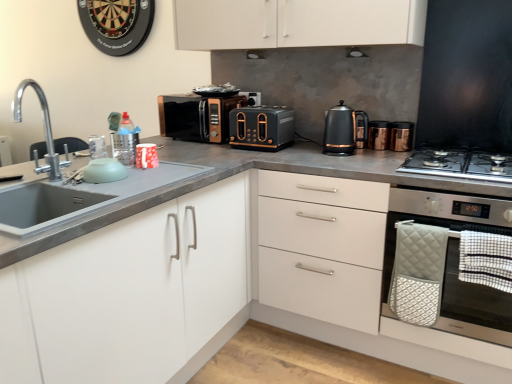
Describe the element at coordinates (342, 130) in the screenshot. I see `black metallic kettle at upper right` at that location.

How much space does black matte toaster at center, which is counted as the 4th appliance, starting from the bottom, occupy horizontally?

0.56 inches.

What is the approximate height of white matte cabinet at center, arranged as the 2th cabinetry when viewed from the left?

white matte cabinet at center, arranged as the 2th cabinetry when viewed from the left, is 22.21 inches in height.

Identify the location of matte black toaster at center. The width and height of the screenshot is (512, 384). (261, 128).

Identify the location of matte green bowl at left, which appears as the fourth appliance when viewed from the back. The image size is (512, 384). (104, 171).

How much space does matte green bowl at left, arranged as the first appliance when ordered from the bottom, occupy vertically?

matte green bowl at left, arranged as the first appliance when ordered from the bottom, is 7.90 centimeters tall.

Describe the element at coordinates (130, 293) in the screenshot. The width and height of the screenshot is (512, 384). I see `white matte cabinet at left, the first cabinetry viewed from the left` at that location.

Image resolution: width=512 pixels, height=384 pixels. What do you see at coordinates (197, 117) in the screenshot?
I see `black glossy microwave at center` at bounding box center [197, 117].

The width and height of the screenshot is (512, 384). Describe the element at coordinates (45, 130) in the screenshot. I see `chrome metallic faucet at left` at that location.

Locate an element on the screen. black metallic kettle at upper right is located at coordinates (342, 130).

Where is `cabinetry that is on the right side of black glossy microwave at center`? The width and height of the screenshot is (512, 384). cabinetry that is on the right side of black glossy microwave at center is located at coordinates (258, 258).

Can you confirm if white matte cabinet at center, arranged as the 2th cabinetry when viewed from the left, is wider than black glossy microwave at center?

Indeed, white matte cabinet at center, arranged as the 2th cabinetry when viewed from the left, has a greater width compared to black glossy microwave at center.

Can you confirm if white matte cabinet at center, arranged as the 2th cabinetry when viewed from the left, is taller than black glossy microwave at center?

Yes, white matte cabinet at center, arranged as the 2th cabinetry when viewed from the left, is taller than black glossy microwave at center.

What's the angular difference between white matte cabinet at left, the first cabinetry viewed from the left, and white matte cabinet at center, arranged as the 2th cabinetry when viewed from the left,'s facing directions?

They differ by 89.9 degrees in their facing directions.

From a real-world perspective, which is physically above, white matte cabinet at left, the first cabinetry viewed from the left, or white matte cabinet at center, marked as the first cabinetry in a right-to-left arrangement?

From a 3D spatial view, white matte cabinet at center, marked as the first cabinetry in a right-to-left arrangement, is above.

Does point (59, 372) come in front of point (362, 165)?

Yes, it is in front of point (362, 165).

Considering the positions of objects black matte toaster at center, the first appliance viewed from the back, and stainless steel gas stove at right in the image provided, who is more to the left, black matte toaster at center, the first appliance viewed from the back, or stainless steel gas stove at right?

black matte toaster at center, the first appliance viewed from the back, is more to the left.

Is black matte toaster at center, arranged as the 4th appliance when viewed from the front, in front of stainless steel gas stove at right?

No, it is behind stainless steel gas stove at right.

Is stainless steel gas stove at right a part of black matte toaster at center, arranged as the 4th appliance when viewed from the front?

No, stainless steel gas stove at right is located outside of black matte toaster at center, arranged as the 4th appliance when viewed from the front.

Does point (253, 97) lie in front of point (493, 177)?

No.

Is point (213, 131) more distant than point (451, 150)?

Yes, point (213, 131) is farther from viewer.

Is black glossy microwave at center to the left of stainless steel gas stove at right from the viewer's perspective?

Yes, black glossy microwave at center is to the left of stainless steel gas stove at right.

Considering the relative sizes of black glossy microwave at center and stainless steel gas stove at right in the image provided, is black glossy microwave at center smaller than stainless steel gas stove at right?

Incorrect, black glossy microwave at center is not smaller in size than stainless steel gas stove at right.

From the image's perspective, between gold metallic canister at upper right, placed as the second appliance when sorted from front to back, and black matte toaster at center, the first appliance viewed from the back, which one is located above?

black matte toaster at center, the first appliance viewed from the back, from the image's perspective.

What's the angular difference between gold metallic canister at upper right, which is counted as the third appliance, starting from the top, and black matte toaster at center, arranged as the 4th appliance when viewed from the front,'s facing directions?

The angle between the facing direction of gold metallic canister at upper right, which is counted as the third appliance, starting from the top, and the facing direction of black matte toaster at center, arranged as the 4th appliance when viewed from the front, is 2.74 degrees.

Looking at this image, is gold metallic canister at upper right, which is counted as the third appliance, starting from the top, looking in the opposite direction of black matte toaster at center, which is the second appliance in left-to-right order?

No, gold metallic canister at upper right, which is counted as the third appliance, starting from the top,'s orientation is not away from black matte toaster at center, which is the second appliance in left-to-right order.

From a real-world perspective, is gold metallic canister at upper right, which ranks as the 3th appliance in back-to-front order, on top of black matte toaster at center, which is counted as the 4th appliance, starting from the bottom?

Incorrect, from a real-world perspective, gold metallic canister at upper right, which ranks as the 3th appliance in back-to-front order, is lower than black matte toaster at center, which is counted as the 4th appliance, starting from the bottom.

Considering the sizes of black matte exhaust hood at upper center, acting as the second exhaust hood starting from the front, and metallic copper kettle at upper right, the 3th appliance from the bottom, in the image, is black matte exhaust hood at upper center, acting as the second exhaust hood starting from the front, taller or shorter than metallic copper kettle at upper right, the 3th appliance from the bottom,?

black matte exhaust hood at upper center, acting as the second exhaust hood starting from the front, is shorter than metallic copper kettle at upper right, the 3th appliance from the bottom.

From the image's perspective, is black matte exhaust hood at upper center, marked as the first exhaust hood in a left-to-right arrangement, on metallic copper kettle at upper right, the 3th appliance from the bottom?

Yes, from the image's perspective, black matte exhaust hood at upper center, marked as the first exhaust hood in a left-to-right arrangement, is over metallic copper kettle at upper right, the 3th appliance from the bottom.

Looking at their sizes, would you say black matte exhaust hood at upper center, which is the 1th exhaust hood in back-to-front order, is wider or thinner than metallic copper kettle at upper right, which is counted as the third appliance, starting from the front?

black matte exhaust hood at upper center, which is the 1th exhaust hood in back-to-front order, is wider than metallic copper kettle at upper right, which is counted as the third appliance, starting from the front.

How different are the orientations of black matte exhaust hood at upper center, which is the 1th exhaust hood in back-to-front order, and metallic copper kettle at upper right, the 2th appliance from the right, in degrees?

black matte exhaust hood at upper center, which is the 1th exhaust hood in back-to-front order, and metallic copper kettle at upper right, the 2th appliance from the right, are facing 2.02 degrees away from each other.

How much distance is there between black glossy microwave at center and matte green bowl at left, placed as the 4th appliance when sorted from right to left?

33.68 inches.

Can matte green bowl at left, which is counted as the fourth appliance, starting from the top, be found inside black glossy microwave at center?

No, black glossy microwave at center does not contain matte green bowl at left, which is counted as the fourth appliance, starting from the top.

I want to click on microwave oven above the matte green bowl at left, the 1th appliance from the left (from a real-world perspective), so click(197, 117).

From the image's perspective, between black glossy microwave at center and matte green bowl at left, which ranks as the first appliance in front-to-back order, who is located below?

matte green bowl at left, which ranks as the first appliance in front-to-back order.

From a real-world perspective, starting from the black glossy microwave at center, which cabinetry is the 1st one below it? Please provide its 2D coordinates.

[(258, 258)]

Where is `cabinetry behind the white matte cabinet at center, arranged as the 2th cabinetry when viewed from the left`? The image size is (512, 384). cabinetry behind the white matte cabinet at center, arranged as the 2th cabinetry when viewed from the left is located at coordinates (130, 293).

Which object lies further to the anchor point black metallic kettle at upper right, white matte cabinet at center, marked as the first cabinetry in a right-to-left arrangement, or white matte cabinet at left, the first cabinetry viewed from the left?

white matte cabinet at left, the first cabinetry viewed from the left, is further to black metallic kettle at upper right.

Based on their spatial positions, is black matte toaster at center, which is counted as the third appliance, starting from the right, or metallic copper kettle at upper right, the 2th appliance from the right, further from black matte exhaust hood at upper center, acting as the second exhaust hood starting from the back?

Among the two, black matte toaster at center, which is counted as the third appliance, starting from the right, is located further to black matte exhaust hood at upper center, acting as the second exhaust hood starting from the back.

Considering their positions, is black matte exhaust hood at upper center, the 2th exhaust hood in the right-to-left sequence, positioned further to metallic copper kettle at upper right, the 3th appliance from the bottom, than black metallic kettle at upper right?

Based on the image, black matte exhaust hood at upper center, the 2th exhaust hood in the right-to-left sequence, appears to be further to metallic copper kettle at upper right, the 3th appliance from the bottom.

When comparing their distances from stainless steel gas stove at right, does matte green bowl at left, the 1th appliance from the left, or metallic copper kettle at upper right, the 2th appliance from the right, seem further?

Among the two, matte green bowl at left, the 1th appliance from the left, is located further to stainless steel gas stove at right.

Estimate the real-world distances between objects in this image. Which object is further from matte green bowl at left, placed as the 4th appliance when sorted from right to left, white matte cabinet at left, acting as the second cabinetry starting from the right, or chrome metallic faucet at left?

Based on the image, chrome metallic faucet at left appears to be further to matte green bowl at left, placed as the 4th appliance when sorted from right to left.

Looking at the image, which one is located closer to black matte exhaust hood at upper center, which appears as the 2th exhaust hood when viewed from the left, black metallic kettle at upper right or matte green bowl at left, which ranks as the first appliance in front-to-back order?

The object closer to black matte exhaust hood at upper center, which appears as the 2th exhaust hood when viewed from the left, is black metallic kettle at upper right.

From the image, which object appears to be nearer to black matte toaster at center, which is counted as the third appliance, starting from the right, black glossy microwave at center or metallic copper kettle at upper right, which appears as the 2th appliance when viewed from the top?

black glossy microwave at center is positioned closer to the anchor black matte toaster at center, which is counted as the third appliance, starting from the right.

Considering their positions, is chrome metallic faucet at left positioned further to matte black toaster at center than stainless steel oven at right?

chrome metallic faucet at left is further to matte black toaster at center.

You are a GUI agent. You are given a task and a screenshot of the screen. Output one action in this format:
    pyautogui.click(x=<x>, y=<y>)
    Task: Click on the gas stove located between white matte cabinet at center, arranged as the 2th cabinetry when viewed from the left, and matte black toaster at center in the depth direction
    The height and width of the screenshot is (384, 512).
    Given the screenshot: What is the action you would take?
    pyautogui.click(x=460, y=164)

The width and height of the screenshot is (512, 384). Identify the location of toaster between white matte cabinet at left, the first cabinetry viewed from the left, and black matte toaster at center, which is counted as the third appliance, starting from the right, in the front-back direction. (261, 128).

Identify the location of gas stove between white matte cabinet at center, marked as the first cabinetry in a right-to-left arrangement, and stainless steel oven at right from left to right. (460, 164).

Identify the location of gas stove between matte black toaster at center and stainless steel oven at right from left to right. The height and width of the screenshot is (384, 512). (460, 164).